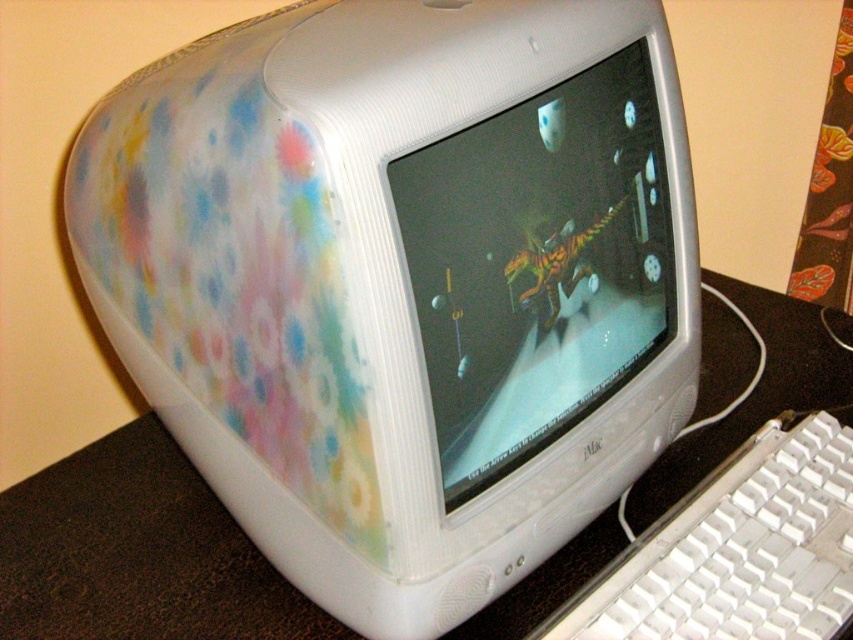
You are setting up a new desk arrangement and want to place a plant between the white glossy monitor at center and the white plastic computer desk at center. Based on their positions, where should you place the plant?

The white glossy monitor at center is positioned on the right side of the white plastic computer desk at center, so you should place the plant between them on the left side of the monitor and the right side of the desk.

You are organizing your desk and need to place a new item between the white plastic computer desk at center and the white plastic keyboard at lower right. Which object should you place the item closer to if you want it to be near the larger object?

You should place the item closer to the white plastic computer desk at center because it is larger in size than the white plastic keyboard at lower right according to the description.

You are a photographer taking a picture of the vintage iMac G3 computer. You notice two points marked on the image at coordinates point (720, 433) and point (769, 609). Which point is closer to the camera?

Point (720, 433) is further to the camera than point (769, 609), so the point closer to the camera is point (769, 609).